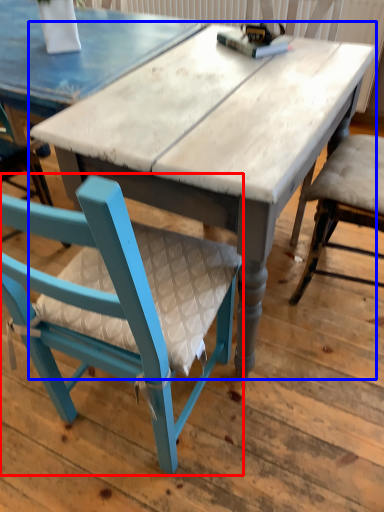
Question: Which object is closer to the camera taking this photo, chair (highlighted by a red box) or table (highlighted by a blue box)?

Choices:
 (A) chair
 (B) table

Answer: (A)